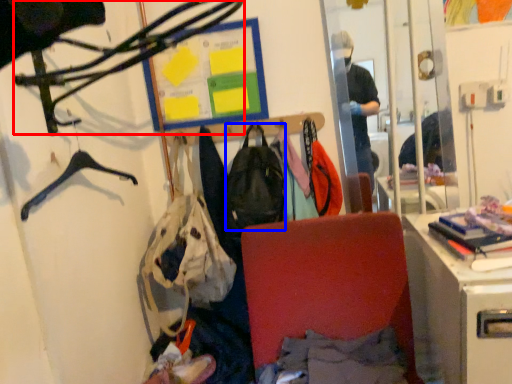
Question: Which object is closer to the camera taking this photo, hanger (highlighted by a red box) or backpack (highlighted by a blue box)?

Choices:
 (A) hanger
 (B) backpack

Answer: (A)